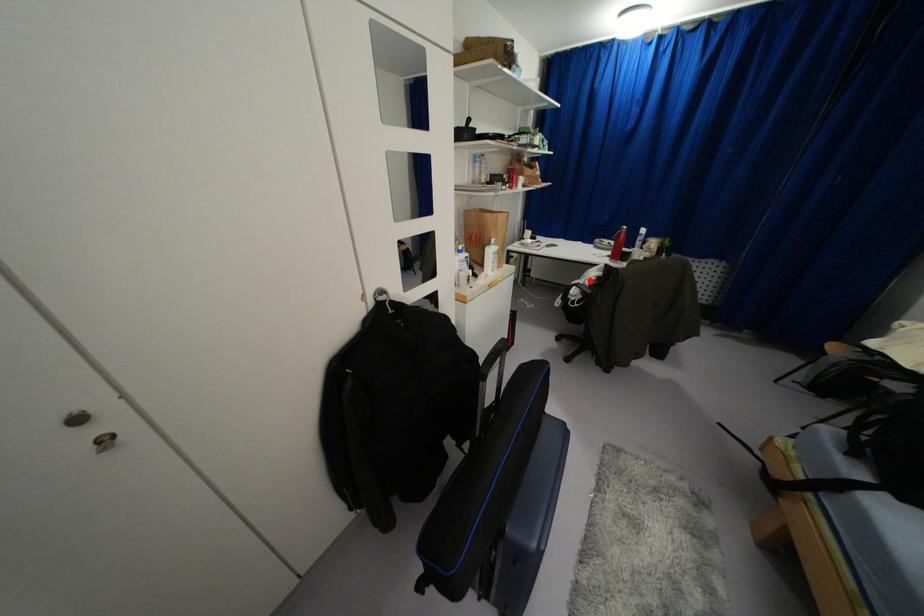
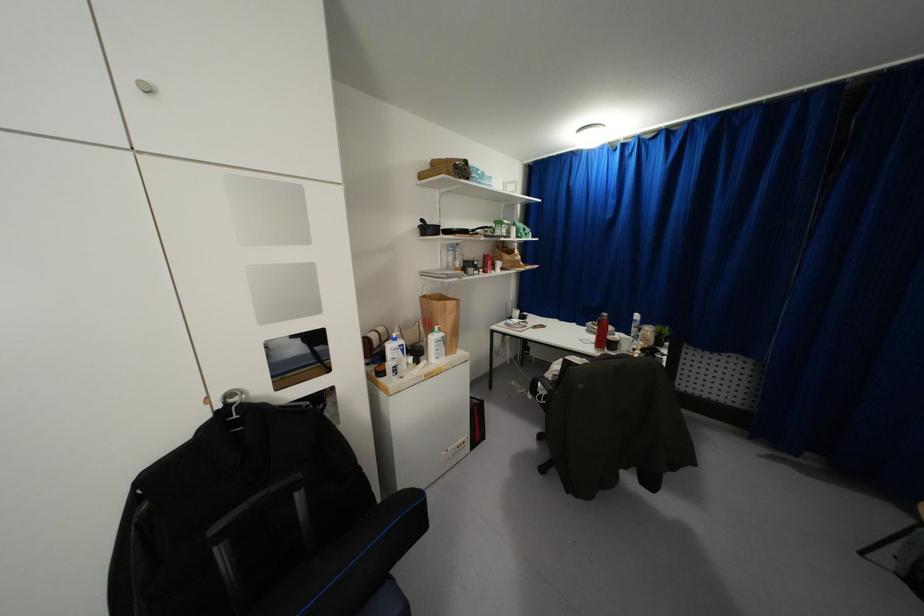
Where in the second image is the point corresponding to the highlighted location from the first image?

(553, 376)